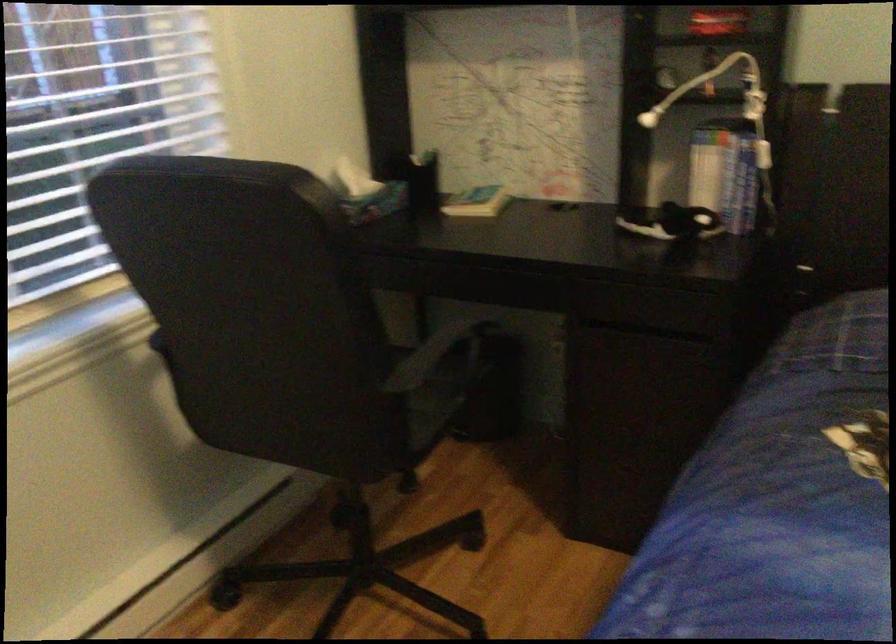
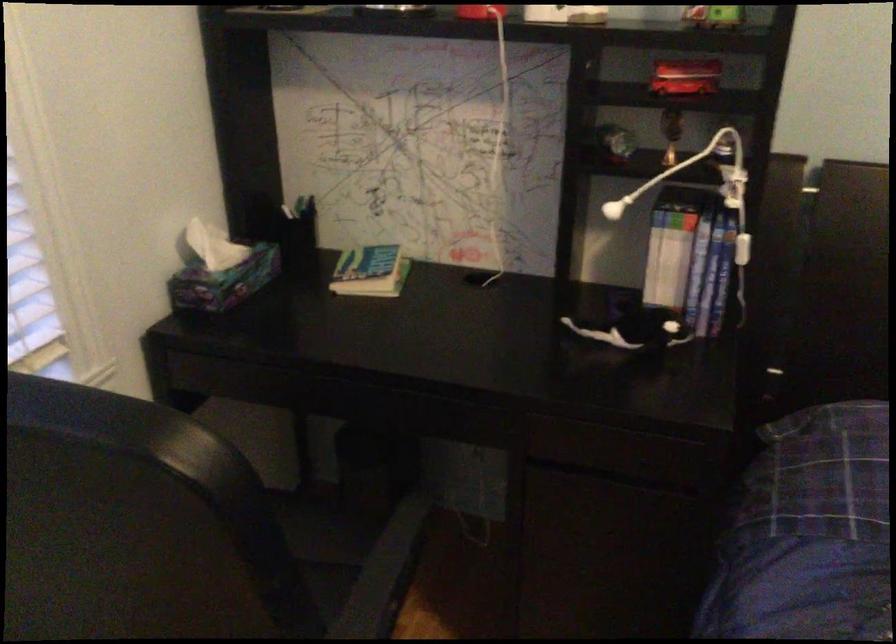
The point at (x=326, y=223) is marked in the first image. Where is the corresponding point in the second image?

(234, 509)